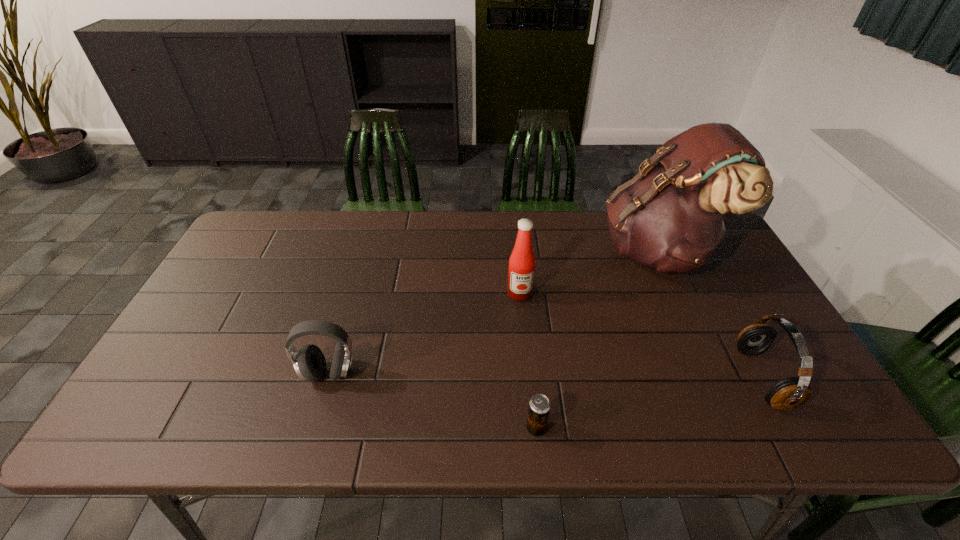
Identify the location of object at the far right corner. (671, 216).

The width and height of the screenshot is (960, 540). I want to click on object that is at the near right corner, so [788, 393].

The width and height of the screenshot is (960, 540). I want to click on vacant space at the far edge, so click(x=546, y=217).

Image resolution: width=960 pixels, height=540 pixels. What are the coordinates of `vacant space at the near edge of the desktop` in the screenshot? It's located at (735, 422).

The image size is (960, 540). Identify the location of free space at the left edge. (211, 325).

Image resolution: width=960 pixels, height=540 pixels. I want to click on vacant space at the right edge of the desktop, so click(714, 285).

Where is `vacant point located between the condiment and the leftmost object`? vacant point located between the condiment and the leftmost object is located at coordinates (424, 333).

At what (x,y) coordinates should I click in order to perform the action: click on empty space that is in between the tallest object and the shortest object. Please return your answer as a coordinate pair (x, y). This screenshot has width=960, height=540. Looking at the image, I should click on (597, 340).

You are a GUI agent. You are given a task and a screenshot of the screen. Output one action in this format:
    pyautogui.click(x=<x>, y=<y>)
    Task: Click on the vacant area that lies between the right headset and the nearest object
    
    Given the screenshot: What is the action you would take?
    pyautogui.click(x=649, y=403)

Where is `empty space that is in between the right headset and the fourth shortest object`? empty space that is in between the right headset and the fourth shortest object is located at coordinates (641, 335).